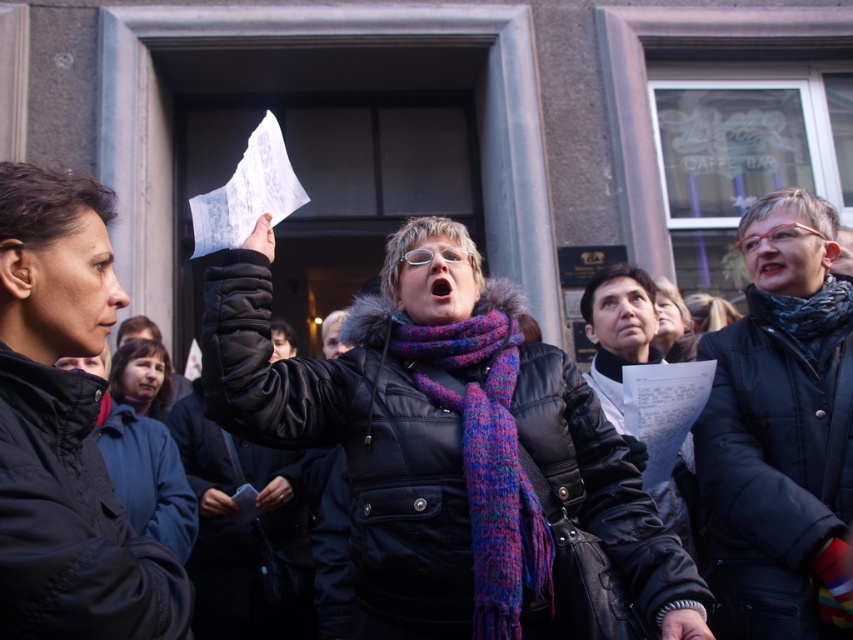
Does purple knitted scarf at center appear on the right side of matte blue scarf at lower left?

→ Indeed, purple knitted scarf at center is positioned on the right side of matte blue scarf at lower left.

Is purple knitted scarf at center closer to camera compared to matte blue scarf at lower left?

Yes.

Does point (355, 563) come farther from viewer compared to point (155, 396)?

No, (355, 563) is in front of (155, 396).

Image resolution: width=853 pixels, height=640 pixels. I want to click on purple knitted scarf at center, so click(x=450, y=474).

Between black matte jacket at upper right and matte blue scarf at lower left, which one has more height?

black matte jacket at upper right is taller.

Is black matte jacket at upper right wider than matte blue scarf at lower left?

Indeed, black matte jacket at upper right has a greater width compared to matte blue scarf at lower left.

Who is more forward, (762, 323) or (152, 404)?

Positioned in front is point (762, 323).

Identify the location of black matte jacket at upper right. (779, 429).

Is matte black jacket at left in front of matte blue scarf at lower left?

Yes.

Which is in front, point (54, 435) or point (161, 385)?

Point (54, 435) is in front.

The image size is (853, 640). What are the coordinates of `matte black jacket at left` in the screenshot? It's located at (65, 428).